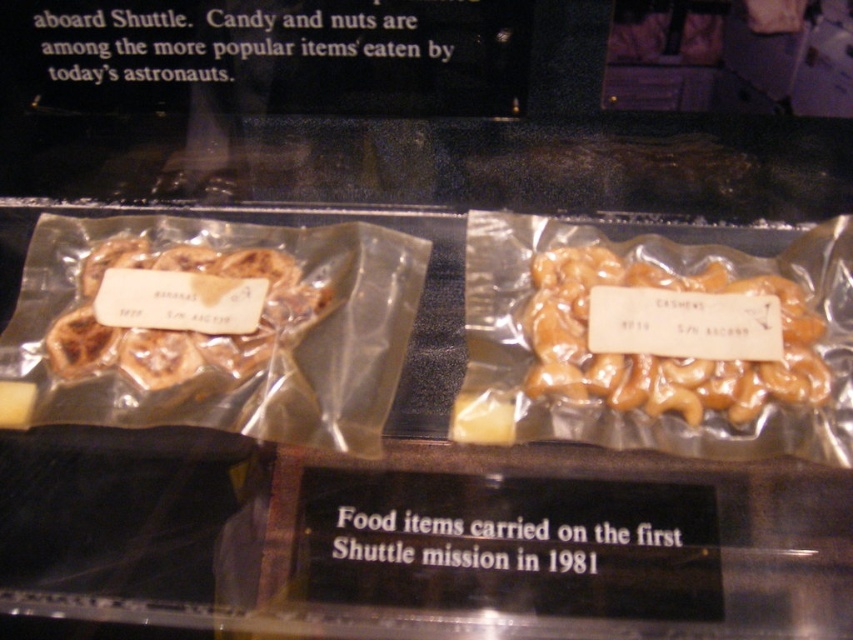
Question: Can you confirm if golden caramel cashews at center is wider than brown matte cashews at left?

Choices:
 (A) no
 (B) yes

Answer: (B)

Question: Which object is farther from the camera taking this photo?

Choices:
 (A) golden caramel cashews at center
 (B) brown matte cashews at left

Answer: (B)

Question: Is golden caramel cashews at center smaller than brown matte cashews at left?

Choices:
 (A) no
 (B) yes

Answer: (A)

Question: Among these objects, which one is nearest to the camera?

Choices:
 (A) golden caramel cashews at center
 (B) brown matte cashews at left

Answer: (A)

Question: Can you confirm if golden caramel cashews at center is positioned below brown matte cashews at left?

Choices:
 (A) yes
 (B) no

Answer: (A)

Question: Which point is farther to the camera?

Choices:
 (A) (618, 275)
 (B) (263, 340)

Answer: (A)